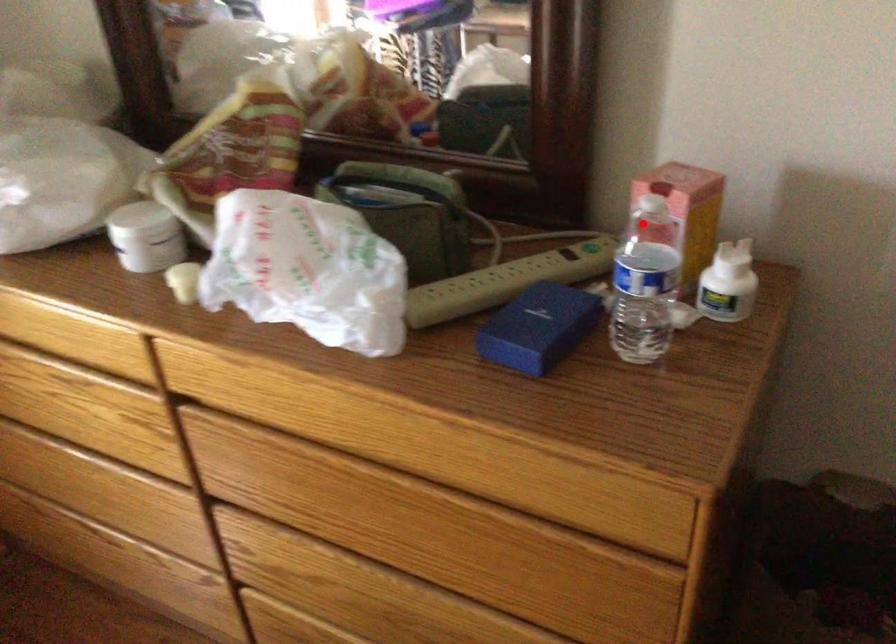
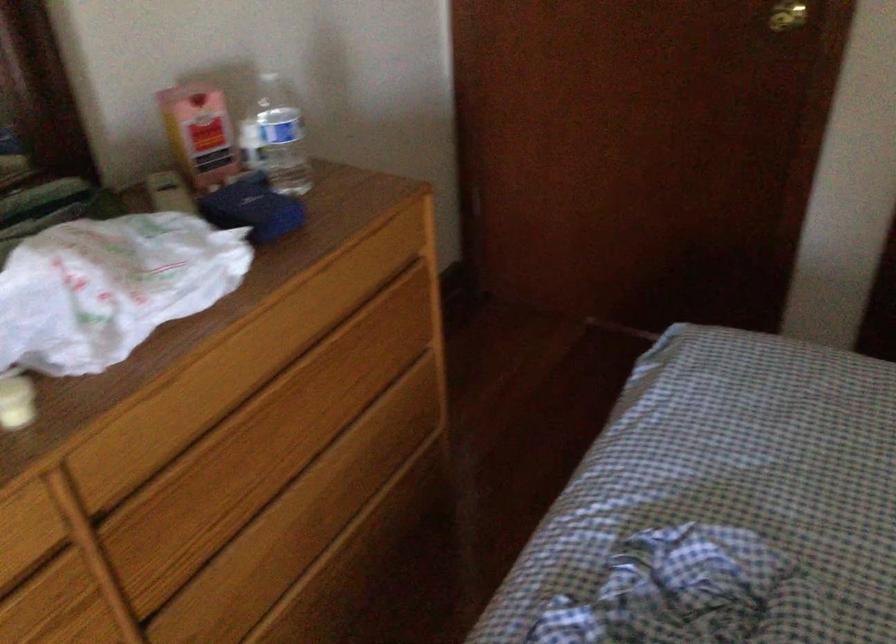
Question: I am providing you with two images of the same scene from different viewpoints. A red point is shown in image1. For the corresponding object point in image2, is it positioned nearer or farther from the camera?

Choices:
 (A) Nearer
 (B) Farther

Answer: (B)